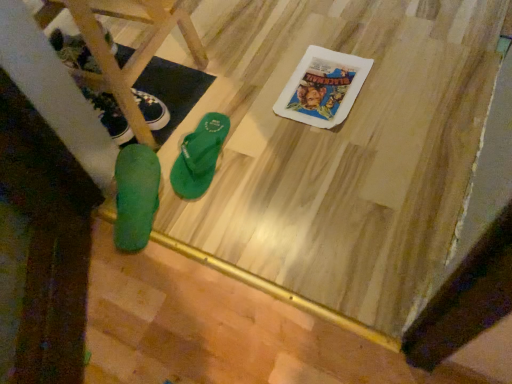
The height and width of the screenshot is (384, 512). In order to click on spots to the right of green rubber flip-flop at lower left, which is the 2th footwear from left to right in this screenshot , I will do `click(214, 200)`.